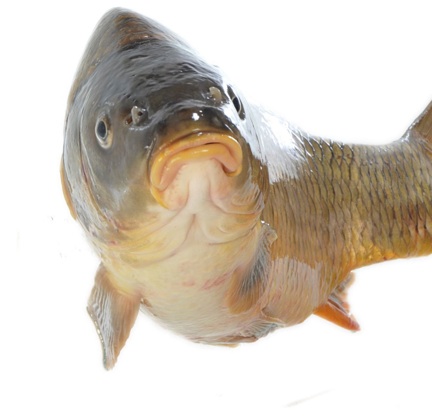
This screenshot has width=432, height=416. What are the coordinates of `scales` in the screenshot? It's located at (321, 188).